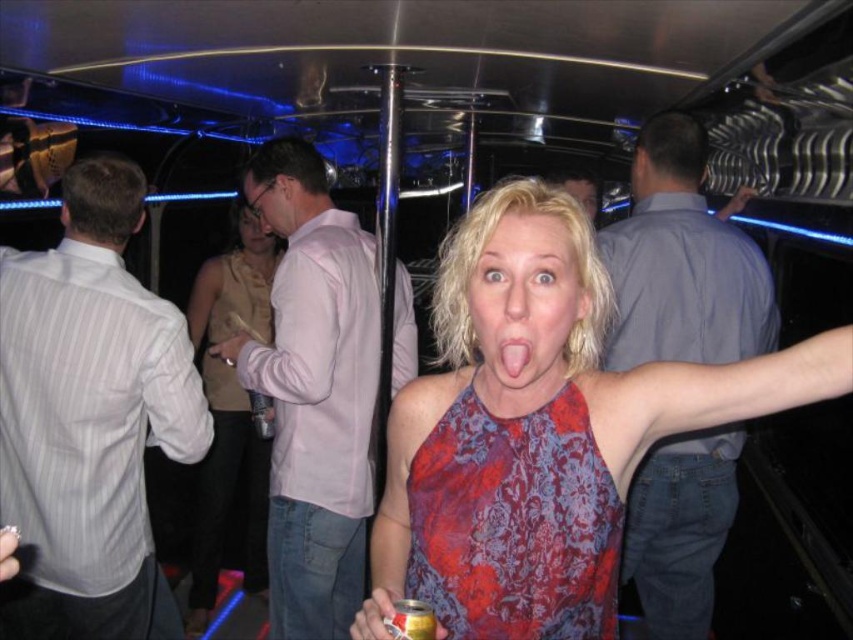
You are a photographer trying to capture the perfect shot of the red floral dress at center. Based on its position at coordinates 0.819 on the x and 0.604 on the y, can you estimate where in the frame the dress is positioned?

The red floral dress at center is located at point 0.819 on the x and 0.604 on the y, which places it slightly to the right and lower middle of the frame.

You are a photographer at the party and want to capture the red floral dress at center and the gold metallic can at center in a single photo. Which object should you focus on first if you want to ensure both are in frame without cropping?

You should focus on the red floral dress at center first because it has a greater height compared to the gold metallic can at center, so ensuring it fits properly will automatically accommodate the smaller can in the frame.